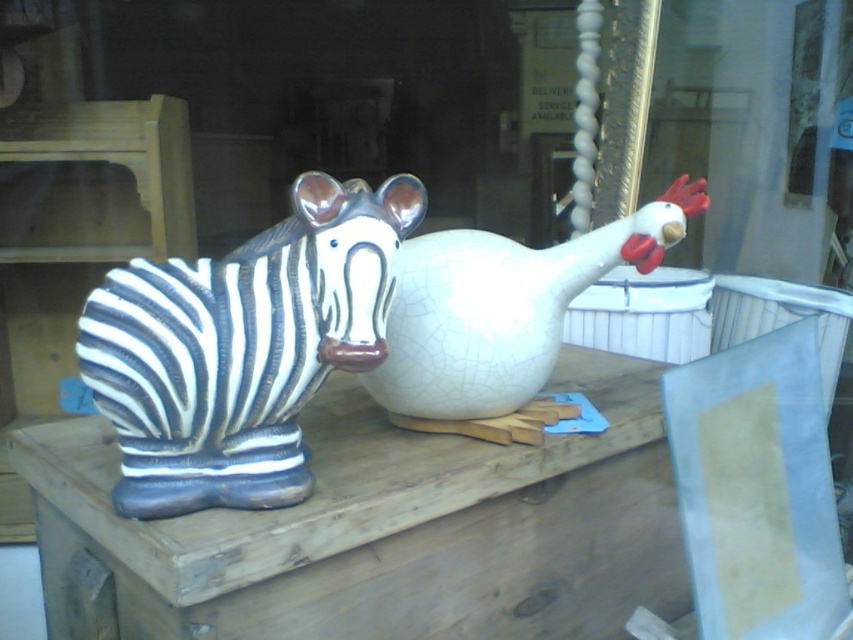
Question: Which object is the closest to the cracked white vase at center?

Choices:
 (A) crackle glaze zebra at center
 (B) crackle glaze zebra statue at left

Answer: (A)

Question: Is crackle glaze zebra at center positioned before crackle glaze zebra statue at left?

Choices:
 (A) no
 (B) yes

Answer: (B)

Question: Which is nearer to the crackle glaze zebra at center?

Choices:
 (A) cracked white vase at center
 (B) crackle glaze zebra statue at left

Answer: (A)

Question: Which point is farther from the camera taking this photo?

Choices:
 (A) (0, 480)
 (B) (322, 266)

Answer: (A)

Question: From the image, what is the correct spatial relationship of crackle glaze zebra statue at left in relation to cracked white vase at center?

Choices:
 (A) left
 (B) right

Answer: (A)

Question: Can you confirm if crackle glaze zebra at center is positioned to the left of crackle glaze zebra statue at left?

Choices:
 (A) yes
 (B) no

Answer: (B)